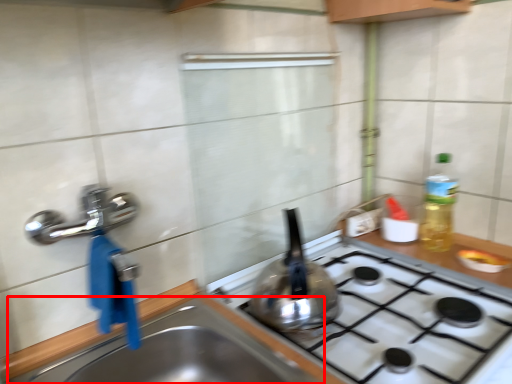
Question: From the image's perspective, where is sink (annotated by the red box) located relative to kitchen appliance?

Choices:
 (A) above
 (B) below

Answer: (B)